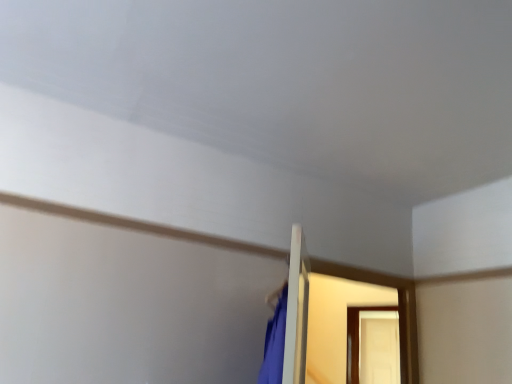
This screenshot has width=512, height=384. Find the location of `transparent glass window at center`. transparent glass window at center is located at coordinates (336, 320).

What do you see at coordinates (336, 320) in the screenshot?
I see `transparent glass window at center` at bounding box center [336, 320].

Locate an element on the screen. This screenshot has height=384, width=512. transparent glass window at center is located at coordinates (336, 320).